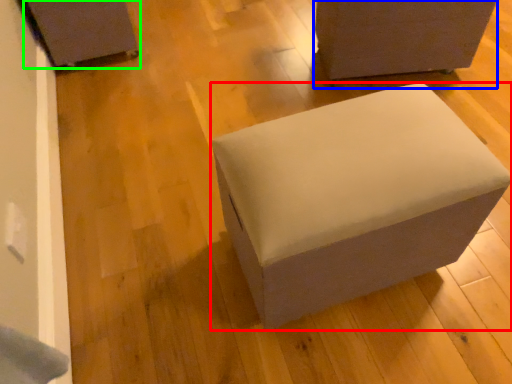
Question: Estimate the real-world distances between objects in this image. Which object is farther from furniture (highlighted by a red box), furniture (highlighted by a blue box) or furniture (highlighted by a green box)?

Choices:
 (A) furniture
 (B) furniture

Answer: (B)